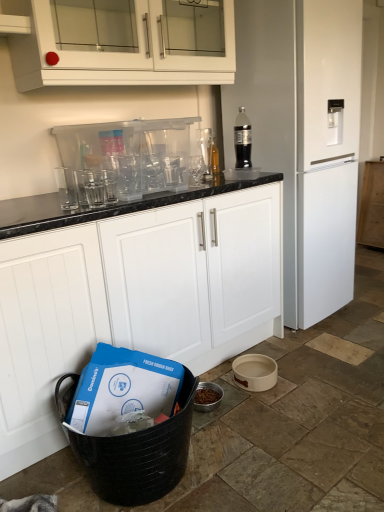
Question: Does white glossy cabinet at upper center, acting as the 2th cabinetry starting from the back, have a greater height compared to white matte refrigerator at right?

Choices:
 (A) yes
 (B) no

Answer: (B)

Question: Can you confirm if white glossy cabinet at upper center, the 2th cabinetry from the right, is bigger than white matte refrigerator at right?

Choices:
 (A) yes
 (B) no

Answer: (B)

Question: Does white glossy cabinet at upper center, which is the 2th cabinetry from front to back, appear on the right side of white matte refrigerator at right?

Choices:
 (A) yes
 (B) no

Answer: (B)

Question: Is white glossy cabinet at upper center, which is the 2th cabinetry from front to back, positioned beyond the bounds of white matte refrigerator at right?

Choices:
 (A) no
 (B) yes

Answer: (B)

Question: From a real-world perspective, is white glossy cabinet at upper center, acting as the 2th cabinetry starting from the back, on white matte refrigerator at right?

Choices:
 (A) yes
 (B) no

Answer: (A)

Question: Considering the positions of transparent plastic glasses at upper center, which appears as the 2th appliance when viewed from the right, and translucent glass bottle at upper center, which ranks as the 2th bottle in front-to-back order, in the image, is transparent plastic glasses at upper center, which appears as the 2th appliance when viewed from the right, wider or thinner than translucent glass bottle at upper center, which ranks as the 2th bottle in front-to-back order,?

Choices:
 (A) thin
 (B) wide

Answer: (B)

Question: From the image's perspective, is transparent plastic glasses at upper center, positioned as the 1th appliance in top-to-bottom order, positioned above or below translucent glass bottle at upper center, acting as the first bottle starting from the left?

Choices:
 (A) above
 (B) below

Answer: (B)

Question: Considering the relative positions of transparent plastic glasses at upper center, positioned as the 1th appliance in top-to-bottom order, and translucent glass bottle at upper center, arranged as the first bottle when viewed from the back, in the image provided, is transparent plastic glasses at upper center, positioned as the 1th appliance in top-to-bottom order, to the left or to the right of translucent glass bottle at upper center, arranged as the first bottle when viewed from the back,?

Choices:
 (A) right
 (B) left

Answer: (B)

Question: From a real-world perspective, relative to translucent glass bottle at upper center, which appears as the 2th bottle when viewed from the right, is transparent plastic glasses at upper center, acting as the second appliance starting from the bottom, vertically above or below?

Choices:
 (A) above
 (B) below

Answer: (A)

Question: In terms of width, does transparent plastic glasses at upper center, positioned as the 1th appliance in top-to-bottom order, look wider or thinner when compared to white matte cabinet at right, the 3th cabinetry positioned from the front?

Choices:
 (A) wide
 (B) thin

Answer: (A)

Question: Is transparent plastic glasses at upper center, which appears as the 2th appliance when viewed from the right, taller or shorter than white matte cabinet at right, arranged as the third cabinetry when viewed from the left?

Choices:
 (A) short
 (B) tall

Answer: (A)

Question: From the image's perspective, is transparent plastic glasses at upper center, which appears as the 2th appliance when viewed from the right, positioned above or below white matte cabinet at right, the 1th cabinetry when ordered from right to left?

Choices:
 (A) below
 (B) above

Answer: (A)

Question: Considering the positions of point (112, 199) and point (374, 231), is point (112, 199) closer or farther from the camera than point (374, 231)?

Choices:
 (A) closer
 (B) farther

Answer: (A)

Question: From a real-world perspective, relative to white matte refrigerator at right, is white matte cabinet at center, acting as the third cabinetry starting from the right, vertically above or below?

Choices:
 (A) above
 (B) below

Answer: (B)

Question: In terms of height, does white matte cabinet at center, which is the 1th cabinetry in left-to-right order, look taller or shorter compared to white matte refrigerator at right?

Choices:
 (A) short
 (B) tall

Answer: (A)